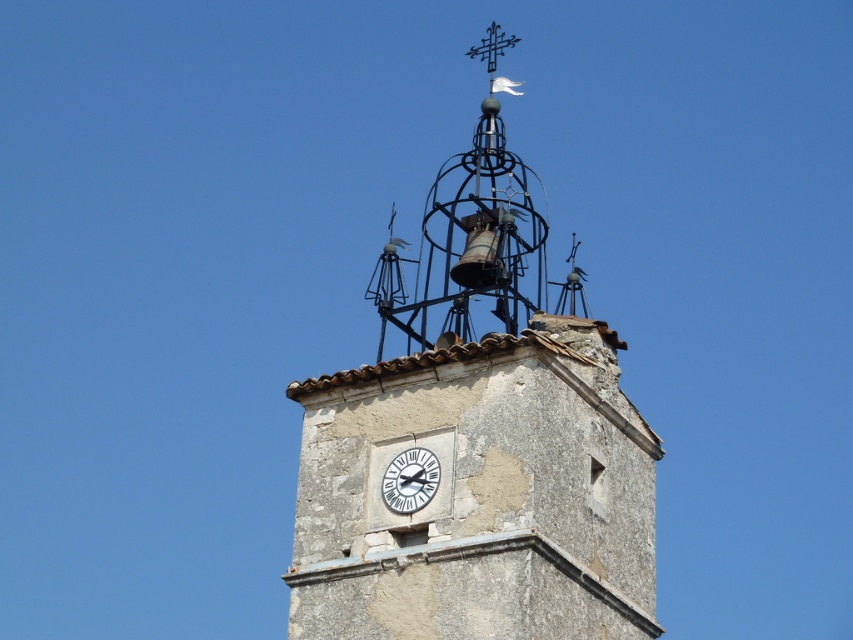
Which is more to the right, stone clock tower at center or black wrought iron spire at upper center?

Positioned to the right is black wrought iron spire at upper center.

Is stone clock tower at center thinner than black wrought iron spire at upper center?

Yes, stone clock tower at center is thinner than black wrought iron spire at upper center.

Is point (329, 557) less distant than point (483, 236)?

That is True.

The height and width of the screenshot is (640, 853). Identify the location of stone clock tower at center. (477, 438).

Between black wrought iron spire at upper center and white stone clock at center, which one appears on the left side from the viewer's perspective?

Positioned to the left is white stone clock at center.

Measure the distance between black wrought iron spire at upper center and camera.

The distance of black wrought iron spire at upper center from camera is 64.58 meters.

Which is behind, point (503, 208) or point (419, 500)?

The point (503, 208) is behind.

Image resolution: width=853 pixels, height=640 pixels. I want to click on black wrought iron spire at upper center, so click(471, 236).

Which is more to the left, stone clock tower at center or white stone clock at center?

white stone clock at center is more to the left.

Between point (505, 44) and point (381, 496), which one is positioned behind?

Point (505, 44)

Does point (598, 556) lie behind point (410, 492)?

Yes.

The height and width of the screenshot is (640, 853). Find the location of `stone clock tower at center`. stone clock tower at center is located at coordinates (477, 438).